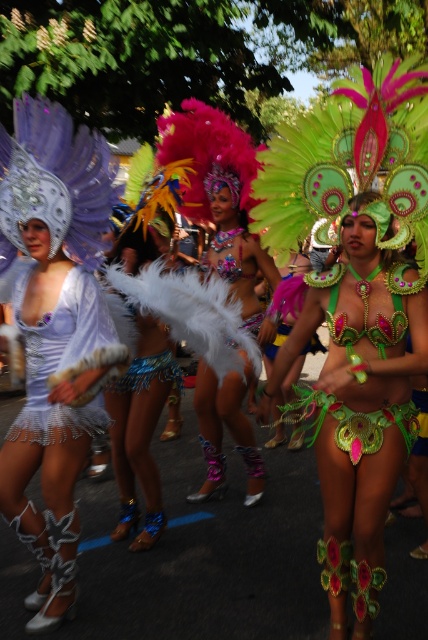
Question: Does shiny silver headdress at center appear on the left side of matte white feathered skirt at left?

Choices:
 (A) yes
 (B) no

Answer: (B)

Question: Does matte white feathered skirt at left appear on the right side of white feather boa at center?

Choices:
 (A) no
 (B) yes

Answer: (A)

Question: Which point appears farthest from the camera in this image?

Choices:
 (A) (15, 259)
 (B) (47, 339)

Answer: (A)

Question: Estimate the real-world distances between objects in this image. Which object is closer to the green sequined bikini at center?

Choices:
 (A) matte white feathers at left
 (B) white feather boa at center
 (C) shiny silver headdress at center
 (D) matte white feathered skirt at left

Answer: (C)

Question: Can you confirm if matte white feathers at left is wider than matte white feathered skirt at left?

Choices:
 (A) yes
 (B) no

Answer: (A)

Question: Which point is farther to the camera?

Choices:
 (A) (50, 444)
 (B) (380, 429)
 (C) (86, 346)
 (D) (208, 374)

Answer: (D)